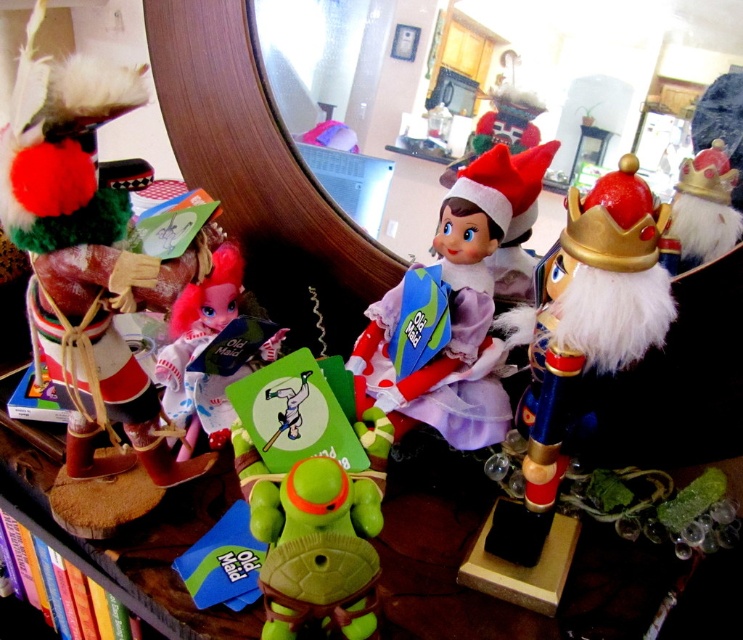
Question: Which point is closer to the camera?

Choices:
 (A) matte purple fabric doll at center
 (B) matte pink fabric doll at center-left

Answer: (B)

Question: Which point is closer to the camera?

Choices:
 (A) (178, 296)
 (B) (458, 385)

Answer: (A)

Question: Considering the relative positions of matte purple fabric doll at center and gold metallic crown at upper right in the image provided, where is matte purple fabric doll at center located with respect to gold metallic crown at upper right?

Choices:
 (A) right
 (B) left

Answer: (B)

Question: Can you confirm if matte pink fabric doll at center-left is bigger than gold metallic crown at upper right?

Choices:
 (A) no
 (B) yes

Answer: (B)

Question: Can you confirm if matte purple fabric doll at center is smaller than gold metallic crown at upper right?

Choices:
 (A) yes
 (B) no

Answer: (B)

Question: Which of the following is the closest to the observer?

Choices:
 (A) matte purple fabric doll at center
 (B) gold metallic crown at upper right
 (C) matte pink fabric doll at center-left

Answer: (C)